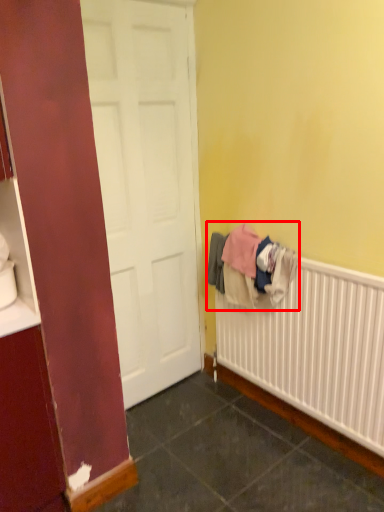
Question: From the image's perspective, what is the correct spatial positioning of clothing (annotated by the red box) in reference to radiator?

Choices:
 (A) above
 (B) below

Answer: (A)